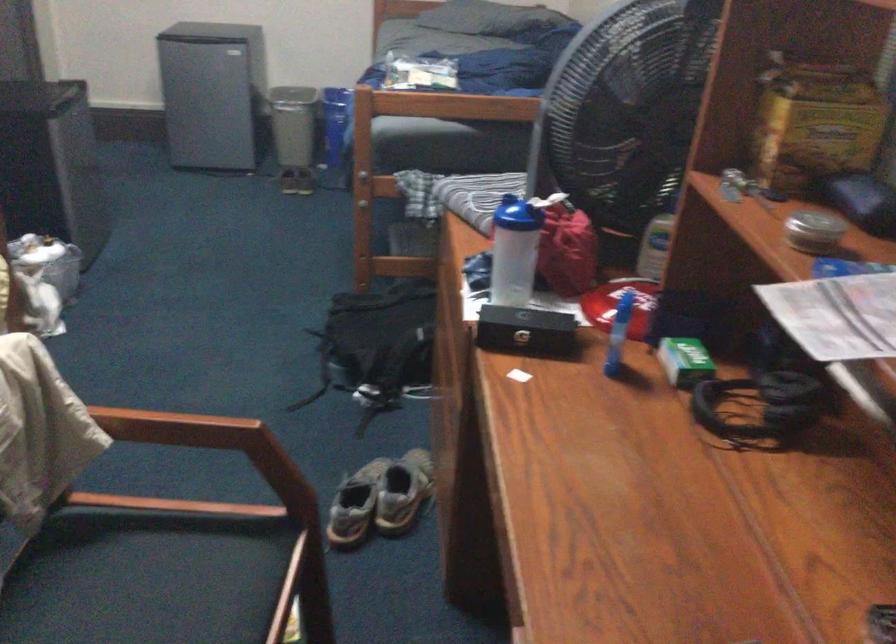
Find the location of a particular element. The width and height of the screenshot is (896, 644). chair sitting surface is located at coordinates (162, 579).